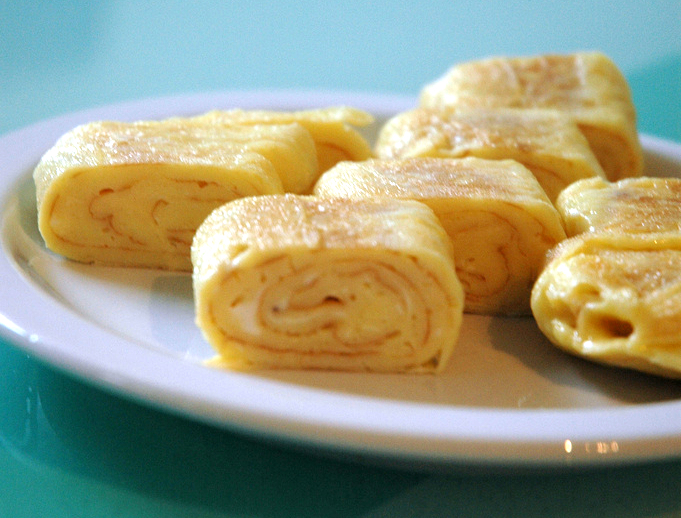
Find the location of `white plate`. white plate is located at coordinates (459, 437).